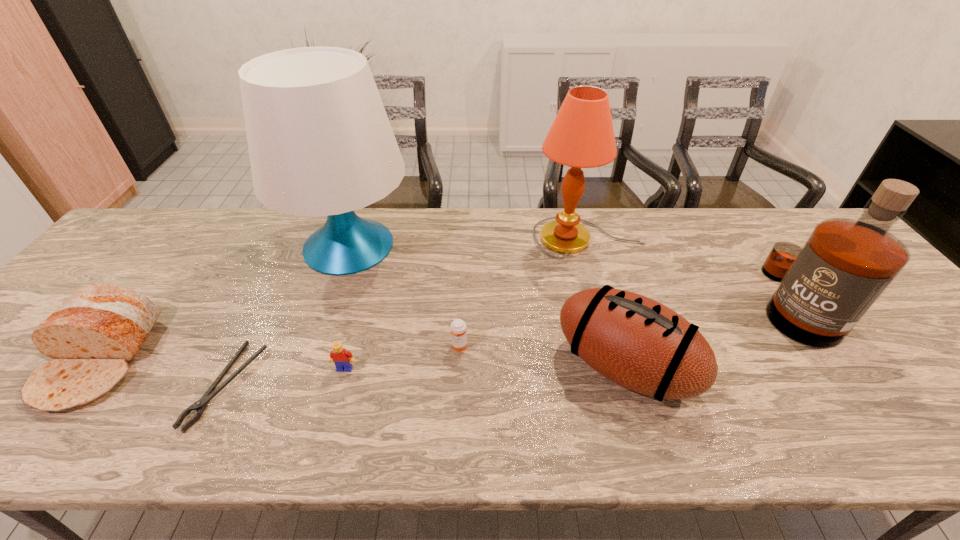
Identify the location of free area in between the table lamp and the fourth object from right to left. This screenshot has width=960, height=540. (404, 296).

Locate an element on the screen. This screenshot has width=960, height=540. vacant region between the lamp and the medicine is located at coordinates (524, 293).

This screenshot has width=960, height=540. I want to click on empty location between the table lamp and the leftmost object, so click(224, 303).

Identify the location of free space between the tongs and the lamp. The height and width of the screenshot is (540, 960). (408, 312).

Find the location of `unoccupied area between the table lamp and the Lego`. unoccupied area between the table lamp and the Lego is located at coordinates (348, 307).

The height and width of the screenshot is (540, 960). What are the coordinates of `empty space that is in between the tongs and the liquor` in the screenshot? It's located at (509, 343).

The image size is (960, 540). What are the coordinates of `free space between the liquor and the shortest object` in the screenshot? It's located at (509, 343).

Locate an element on the screen. Image resolution: width=960 pixels, height=540 pixels. unoccupied position between the football (American) and the fourth shortest object is located at coordinates (361, 363).

Locate an element on the screen. vacant region between the fifth object from left to right and the lamp is located at coordinates (524, 293).

This screenshot has height=540, width=960. In order to click on vacant space that is in between the fourth shortest object and the fifth shortest object in this screenshot , I will do `click(361, 363)`.